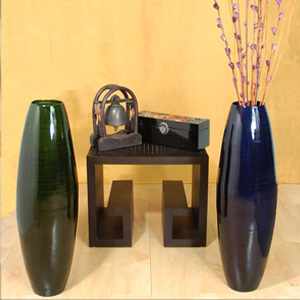
You are a GUI agent. You are given a task and a screenshot of the screen. Output one action in this format:
    pyautogui.click(x=<x>, y=<y>)
    Task: Click on the wall
    
    Given the screenshot: What is the action you would take?
    pyautogui.click(x=68, y=52)